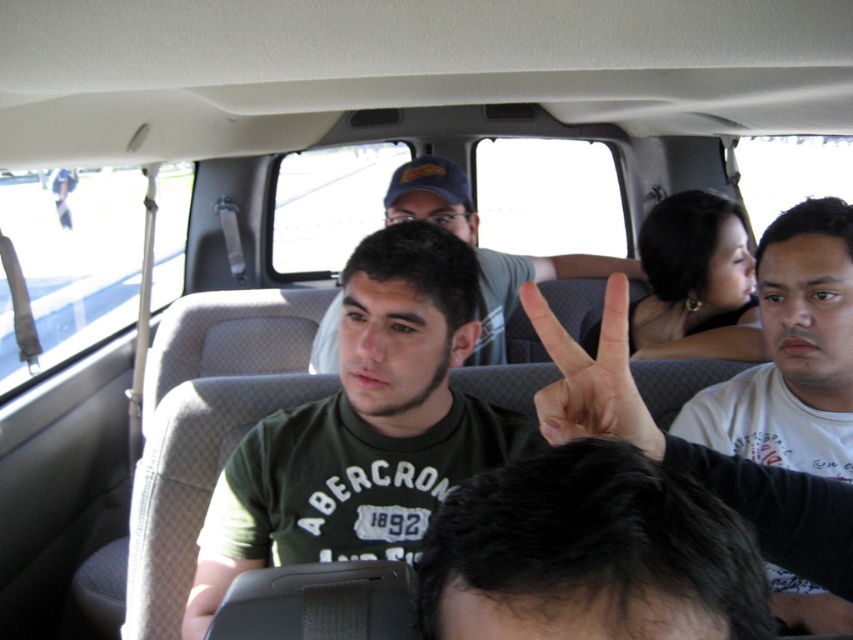
Does green matte shirt at center come in front of green cotton shirt at center?

Yes, it is in front of green cotton shirt at center.

Between point (360, 257) and point (392, 182), which one is positioned behind?

Positioned behind is point (392, 182).

Locate an element on the screen. This screenshot has width=853, height=640. green matte shirt at center is located at coordinates (364, 426).

Is white cotton shirt at upper right in front of green cotton shirt at center?

Result: Yes, white cotton shirt at upper right is in front of green cotton shirt at center.

Between white cotton shirt at upper right and green cotton shirt at center, which one appears on the left side from the viewer's perspective?

green cotton shirt at center

Between point (785, 620) and point (469, 241), which one is positioned in front?

Point (785, 620)

At what (x,y) coordinates should I click in order to perform the action: click on white cotton shirt at upper right. Please return your answer as a coordinate pair (x, y). The width and height of the screenshot is (853, 640). Looking at the image, I should click on (791, 353).

Between point (294, 465) and point (630, 438), which one is positioned in front?

Point (630, 438) is in front.

Which is more to the right, green matte shirt at center or white matte hand at center?

white matte hand at center is more to the right.

Locate an element on the screen. green matte shirt at center is located at coordinates (364, 426).